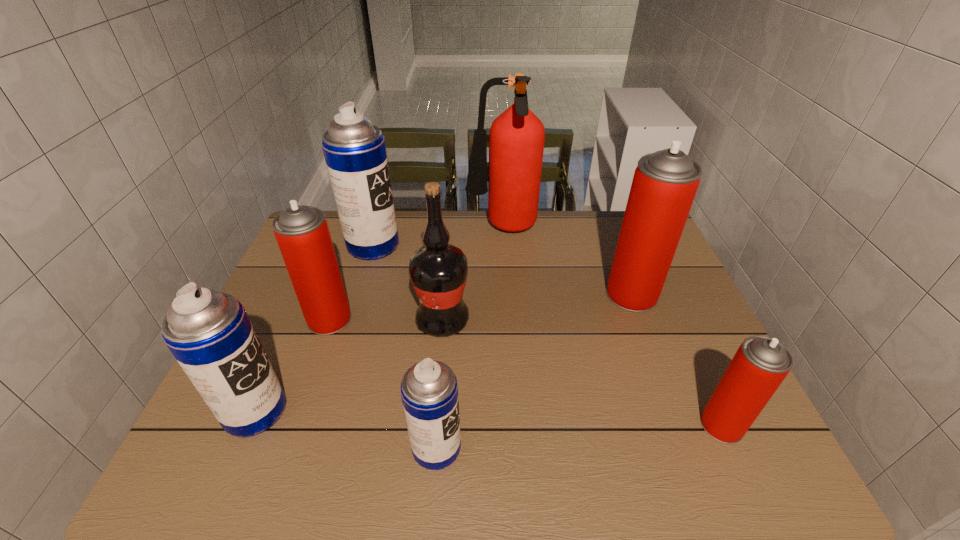
This screenshot has width=960, height=540. In order to click on fire extinguisher in this screenshot , I will do `click(516, 139)`.

In order to click on the biggest blue aerosol can in this screenshot , I will do `click(354, 149)`.

Locate an element on the screen. the farthest blue aerosol can is located at coordinates (354, 149).

Identify the location of the biggest red aerosol can. The width and height of the screenshot is (960, 540). (664, 185).

The height and width of the screenshot is (540, 960). What are the coordinates of `red wine bottle` in the screenshot? It's located at (438, 271).

Locate an element on the screen. This screenshot has width=960, height=540. the leftmost red aerosol can is located at coordinates (302, 233).

Locate an element on the screen. The image size is (960, 540). the second smallest blue aerosol can is located at coordinates (209, 333).

The height and width of the screenshot is (540, 960). I want to click on the nearest red aerosol can, so click(760, 365).

This screenshot has height=540, width=960. I want to click on the fourth aerosol can from left to right, so click(429, 390).

I want to click on the rightmost blue aerosol can, so click(x=429, y=390).